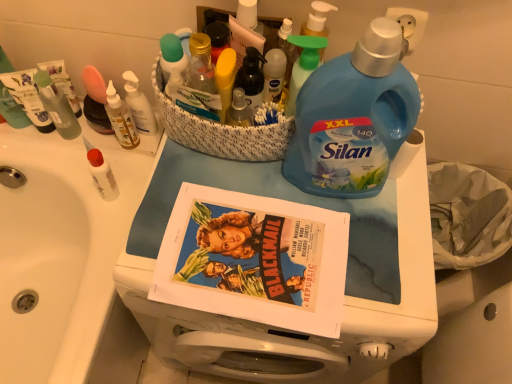
You are a GUI agent. You are given a task and a screenshot of the screen. Output one action in this format:
    pyautogui.click(x=<x>, y=<y>)
    Task: Click on the free point above blue plastic laundry detergent at center (from a real-world perspective)
    
    Given the screenshot: What is the action you would take?
    pyautogui.click(x=288, y=228)